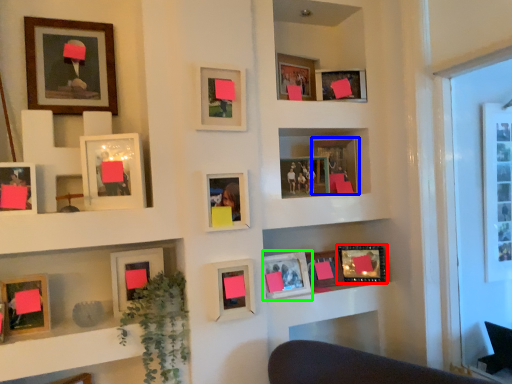
Question: Based on their relative distances, which object is nearer to picture frame (highlighted by a red box)? Choose from picture frame (highlighted by a blue box) and picture frame (highlighted by a green box).

Choices:
 (A) picture frame
 (B) picture frame

Answer: (B)